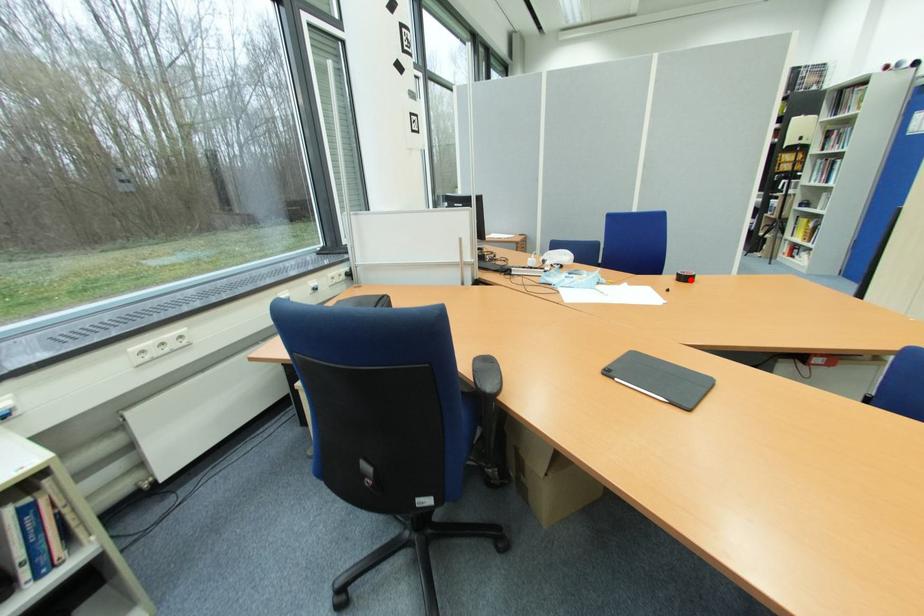
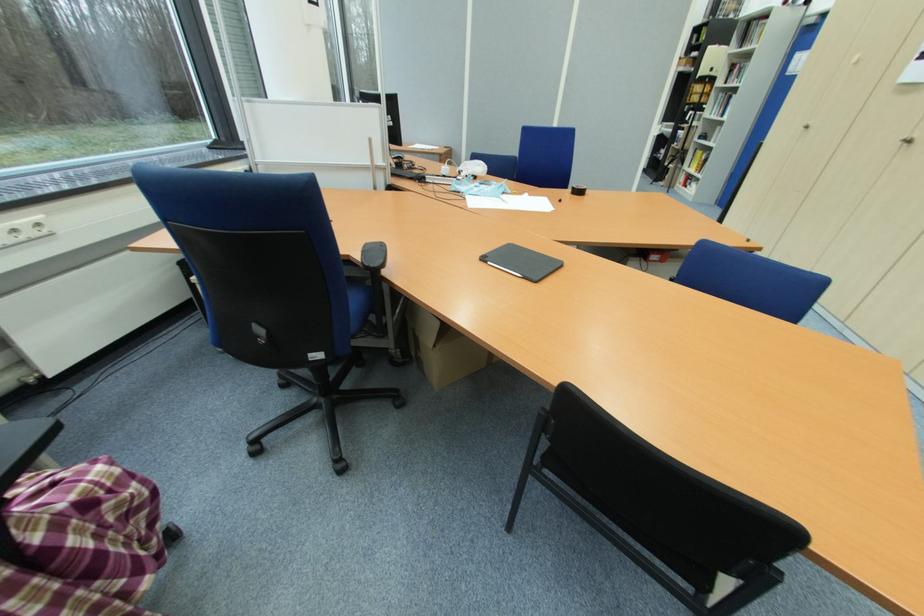
The point at the highlighted location is marked in the first image. Where is the corresponding point in the second image?

(581, 193)